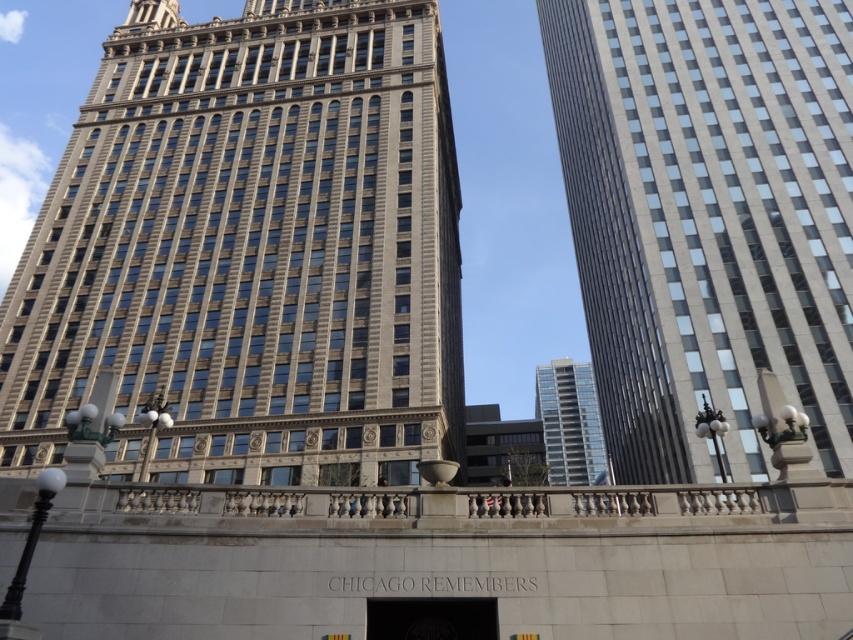
Question: Does beige stone tower at center have a larger size compared to silver metallic building at center?

Choices:
 (A) no
 (B) yes

Answer: (B)

Question: Which object is closer to the camera taking this photo?

Choices:
 (A) beige stone tower at center
 (B) smooth glass skyscraper at right
 (C) silver metallic building at center

Answer: (A)

Question: Which object appears farthest from the camera in this image?

Choices:
 (A) beige stone tower at center
 (B) silver metallic building at center
 (C) smooth glass skyscraper at right

Answer: (B)

Question: Which object is the closest to the silver metallic building at center?

Choices:
 (A) beige stone tower at center
 (B) smooth glass skyscraper at right

Answer: (B)

Question: Does beige stone tower at center have a lesser width compared to smooth glass skyscraper at right?

Choices:
 (A) yes
 (B) no

Answer: (B)

Question: Is smooth glass skyscraper at right to the left of silver metallic building at center from the viewer's perspective?

Choices:
 (A) yes
 (B) no

Answer: (A)